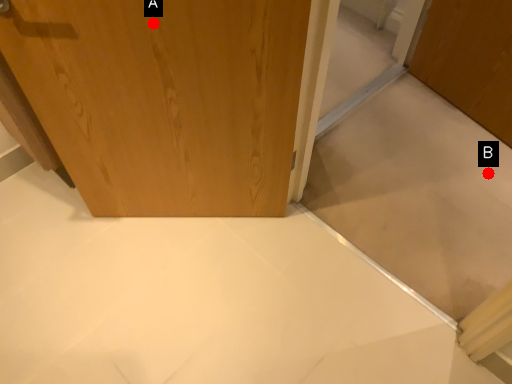
Question: Two points are circled on the image, labeled by A and B beside each circle. Which point is closer to the camera?

Choices:
 (A) A is closer
 (B) B is closer

Answer: (A)